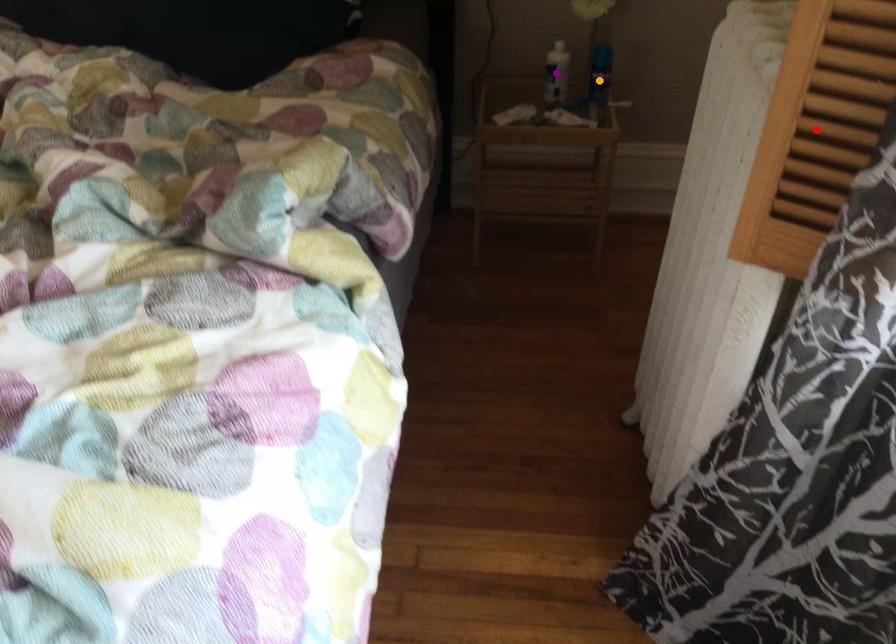
Order these from farthest to nearest:
- orange point
- red point
- purple point

purple point, orange point, red point